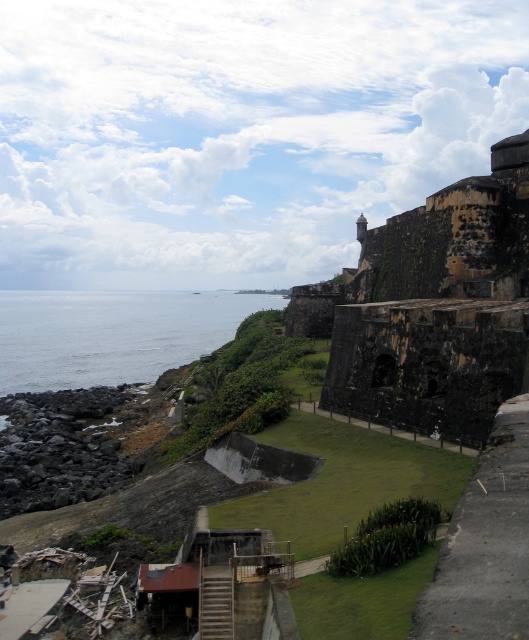
Question: Can you confirm if dark brown stone wall at upper right is thinner than blue water at lower left?

Choices:
 (A) yes
 (B) no

Answer: (A)

Question: Which point appears closest to the camera in this image?

Choices:
 (A) (523, 352)
 (B) (41, 390)

Answer: (A)

Question: Can you confirm if dark brown stone wall at upper right is thinner than blue water at lower left?

Choices:
 (A) yes
 (B) no

Answer: (A)

Question: Among these objects, which one is farthest from the camera?

Choices:
 (A) dark brown stone wall at upper right
 (B) blue water at lower left

Answer: (B)

Question: Is dark brown stone wall at upper right closer to camera compared to blue water at lower left?

Choices:
 (A) no
 (B) yes

Answer: (B)